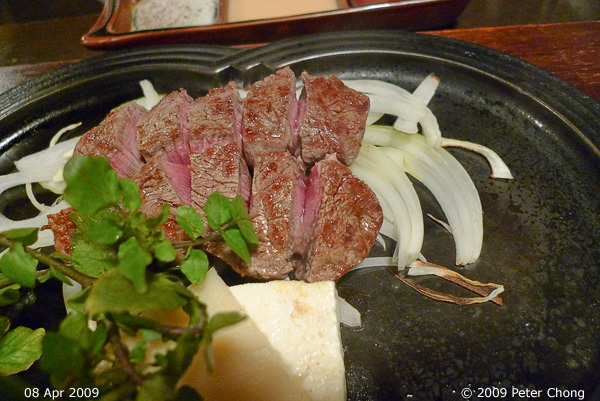
The image size is (600, 401). I want to click on rim of tray, so click(117, 39).